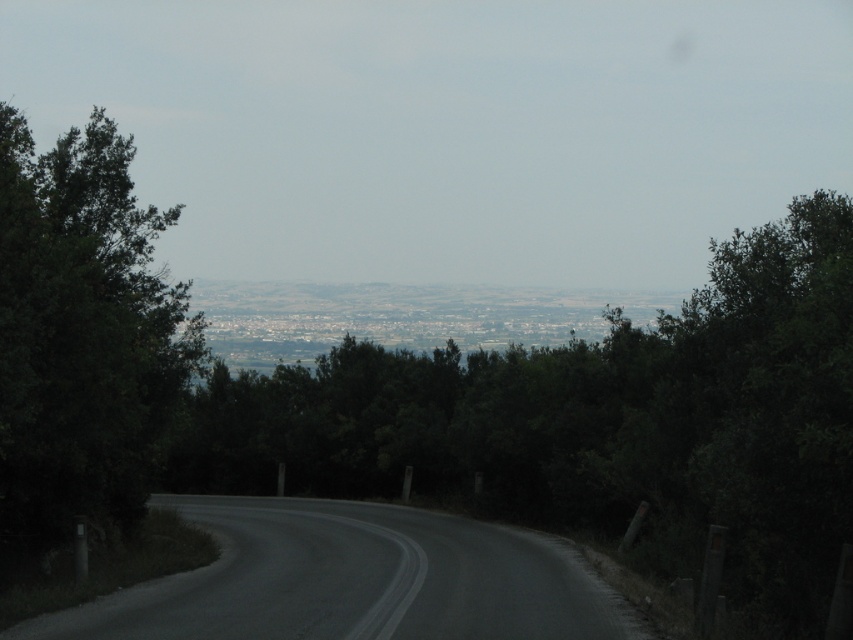
Is point (186, 330) positioned after point (296, 600)?

Yes, it is behind point (296, 600).

Is point (4, 188) closer to camera compared to point (585, 634)?

No, it is not.

What do you see at coordinates (80, 337) in the screenshot? I see `green leafy tree at left` at bounding box center [80, 337].

This screenshot has height=640, width=853. I want to click on green leafy tree at left, so click(80, 337).

Can you confirm if green leafy tree at center is taller than dark asphalt road at center?

Correct, green leafy tree at center is much taller as dark asphalt road at center.

Where is `green leafy tree at center`? This screenshot has width=853, height=640. green leafy tree at center is located at coordinates (598, 422).

Identify the location of green leafy tree at center. This screenshot has width=853, height=640. (598, 422).

Is green leafy tree at center thinner than green leafy tree at left?

In fact, green leafy tree at center might be wider than green leafy tree at left.

Which is more to the right, green leafy tree at center or green leafy tree at left?

green leafy tree at center

Does point (634, 364) come farther from viewer compared to point (167, 291)?

Yes, point (634, 364) is farther from viewer.

You are a GUI agent. You are given a task and a screenshot of the screen. Output one action in this format:
    pyautogui.click(x=<x>, y=<y>)
    Task: Click on the green leafy tree at center
    The width and height of the screenshot is (853, 640).
    Given the screenshot: What is the action you would take?
    pyautogui.click(x=598, y=422)